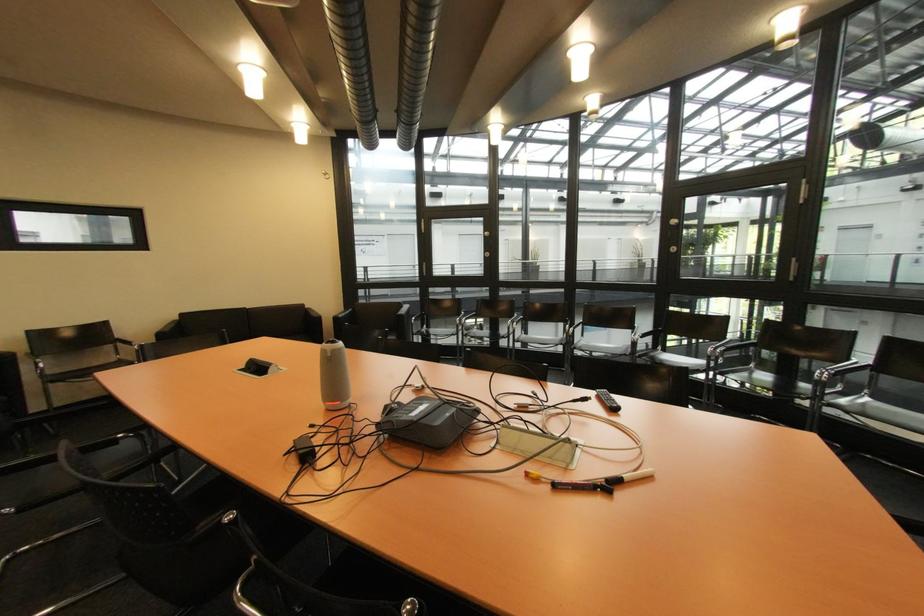
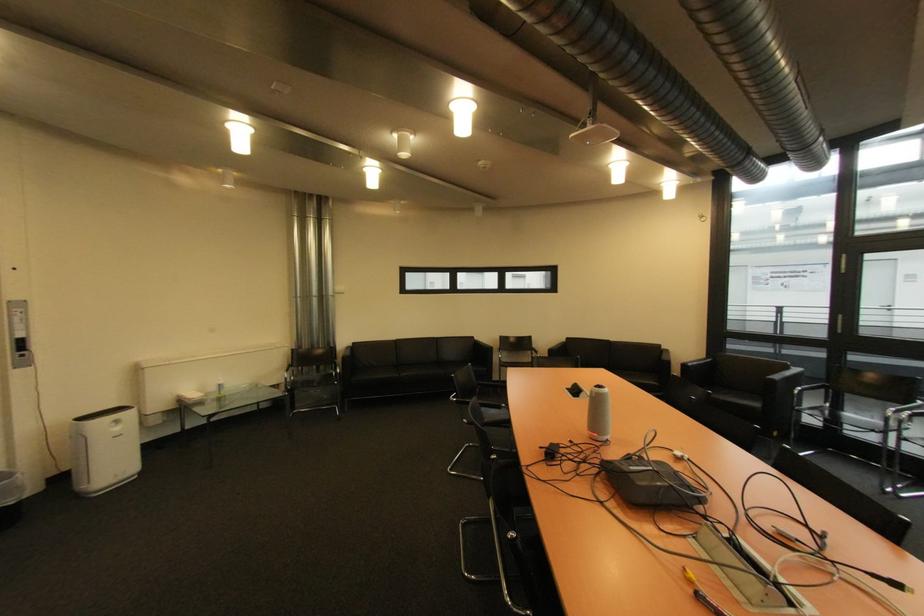
Where in the second image is the point corresponding to [421,320] from the first image?

(808, 390)